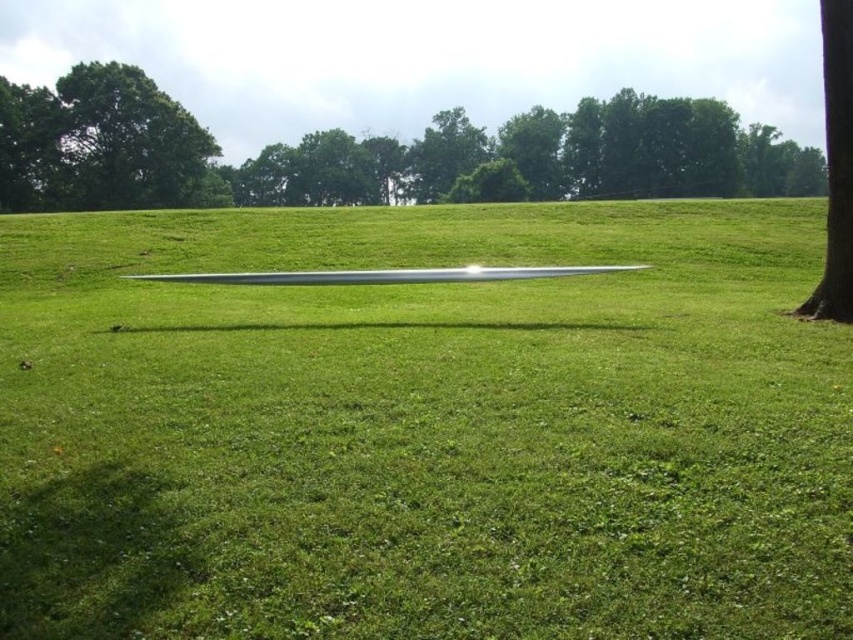
Identify the location of green grassy field at center. The width and height of the screenshot is (853, 640). (422, 428).

Is green grassy field at center to the left of green leafy tree at upper left from the viewer's perspective?

No, green grassy field at center is not to the left of green leafy tree at upper left.

What do you see at coordinates (422, 428) in the screenshot?
I see `green grassy field at center` at bounding box center [422, 428].

You are a GUI agent. You are given a task and a screenshot of the screen. Output one action in this format:
    pyautogui.click(x=<x>, y=<y>)
    Task: Click on the green grassy field at center
    The image size is (853, 640).
    Given the screenshot: What is the action you would take?
    tap(422, 428)

Does green leafy tree at upper left have a lesser width compared to silver metallic blade at center?

In fact, green leafy tree at upper left might be wider than silver metallic blade at center.

Is green leafy tree at upper left below silver metallic blade at center?

No, green leafy tree at upper left is not below silver metallic blade at center.

Is point (131, 166) positioned after point (325, 269)?

That is True.

The width and height of the screenshot is (853, 640). In order to click on green leafy tree at upper left in this screenshot , I will do `click(100, 144)`.

Can you confirm if green grassy field at center is taller than silver metallic blade at center?

Yes.

This screenshot has height=640, width=853. Find the location of `green grassy field at center`. green grassy field at center is located at coordinates [x=422, y=428].